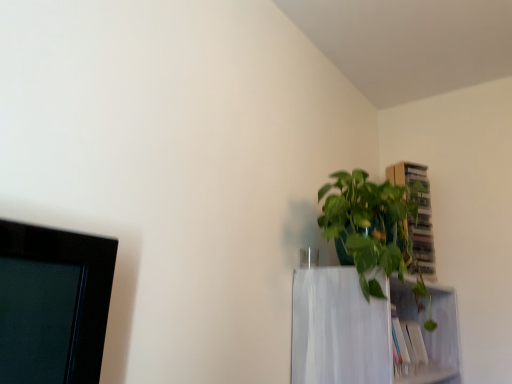
Question: Is green glossy plant at upper right next to white matte shelf at upper right?

Choices:
 (A) yes
 (B) no

Answer: (B)

Question: Considering the relative positions of green glossy plant at upper right and white matte shelf at upper right in the image provided, is green glossy plant at upper right to the right of white matte shelf at upper right from the viewer's perspective?

Choices:
 (A) yes
 (B) no

Answer: (B)

Question: Is green glossy plant at upper right positioned before white matte shelf at upper right?

Choices:
 (A) no
 (B) yes

Answer: (B)

Question: From a real-world perspective, is green glossy plant at upper right below white matte shelf at upper right?

Choices:
 (A) no
 (B) yes

Answer: (A)

Question: Is green glossy plant at upper right at the left side of white matte shelf at upper right?

Choices:
 (A) yes
 (B) no

Answer: (A)

Question: In the image, is wooden cabinet at upper right on the left side or the right side of white matte shelf at upper right?

Choices:
 (A) right
 (B) left

Answer: (A)

Question: Is wooden cabinet at upper right in front of or behind white matte shelf at upper right in the image?

Choices:
 (A) front
 (B) behind

Answer: (B)

Question: Is wooden cabinet at upper right taller or shorter than white matte shelf at upper right?

Choices:
 (A) short
 (B) tall

Answer: (B)

Question: From a real-world perspective, is wooden cabinet at upper right positioned above or below white matte shelf at upper right?

Choices:
 (A) below
 (B) above

Answer: (B)

Question: Looking at the image, does white matte shelf at upper right seem bigger or smaller compared to wooden cabinet at upper right?

Choices:
 (A) small
 (B) big

Answer: (B)

Question: Is point (370, 355) closer or farther from the camera than point (423, 165)?

Choices:
 (A) farther
 (B) closer

Answer: (B)

Question: From the image's perspective, relative to wooden cabinet at upper right, is white matte shelf at upper right above or below?

Choices:
 (A) below
 (B) above

Answer: (A)

Question: Is white matte shelf at upper right inside the boundaries of wooden cabinet at upper right, or outside?

Choices:
 (A) inside
 (B) outside

Answer: (B)

Question: Is point 424,246 closer or farther from the camera than point 372,195?

Choices:
 (A) farther
 (B) closer

Answer: (A)

Question: Considering the positions of wooden cabinet at upper right and green glossy plant at upper right in the image, is wooden cabinet at upper right bigger or smaller than green glossy plant at upper right?

Choices:
 (A) small
 (B) big

Answer: (A)